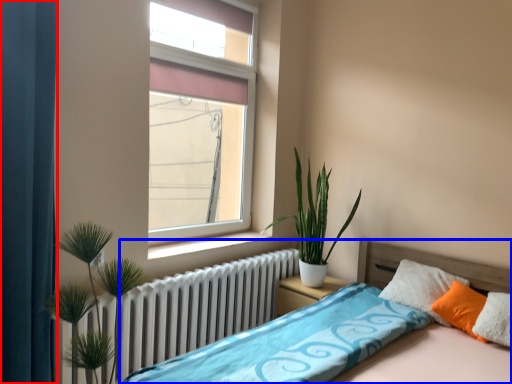
Question: Which object appears farthest to the camera in this image, curtain (highlighted by a red box) or bed (highlighted by a blue box)?

Choices:
 (A) curtain
 (B) bed

Answer: (A)